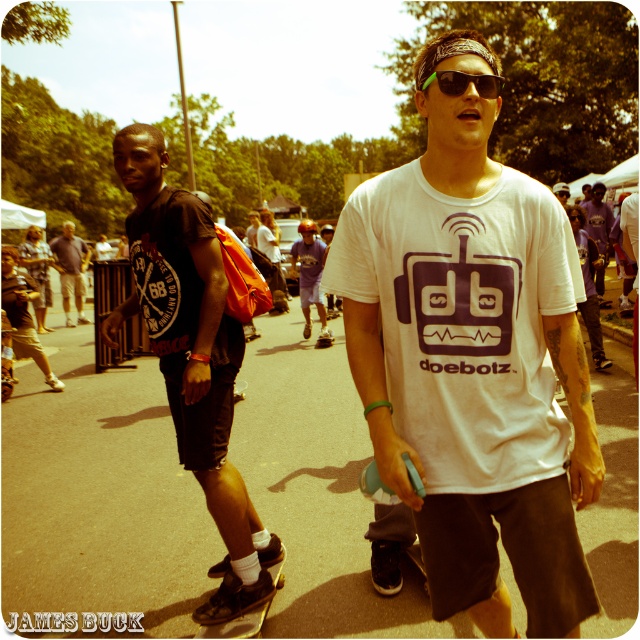
Is the position of white cotton t-shirt at center more distant than that of black rubber skateboard at lower center?

No, it is not.

Can you confirm if white cotton t-shirt at center is taller than black rubber skateboard at lower center?

Indeed, white cotton t-shirt at center has a greater height compared to black rubber skateboard at lower center.

This screenshot has height=640, width=640. I want to click on white cotton t-shirt at center, so click(464, 321).

Can you confirm if dark brown leather jacket at left is positioned below black rubber skateboard at lower center?

Incorrect, dark brown leather jacket at left is not positioned below black rubber skateboard at lower center.

Does dark brown leather jacket at left appear on the left side of black rubber skateboard at lower center?

Indeed, dark brown leather jacket at left is positioned on the left side of black rubber skateboard at lower center.

Which is behind, point (74, 276) or point (257, 632)?

The point (74, 276) is more distant.

You are a GUI agent. You are given a task and a screenshot of the screen. Output one action in this format:
    pyautogui.click(x=<x>, y=<y>)
    Task: Click on the dark brown leather jacket at left
    This screenshot has height=640, width=640.
    Given the screenshot: What is the action you would take?
    pyautogui.click(x=70, y=269)

Does point (83, 262) come closer to viewer compared to point (592, 216)?

No, (83, 262) is behind (592, 216).

In the scene shown: Is dark brown leather jacket at left bigger than purple cotton shirt at upper right?

Yes, dark brown leather jacket at left is bigger than purple cotton shirt at upper right.

Where is `dark brown leather jacket at left`? The width and height of the screenshot is (640, 640). dark brown leather jacket at left is located at coordinates (70, 269).